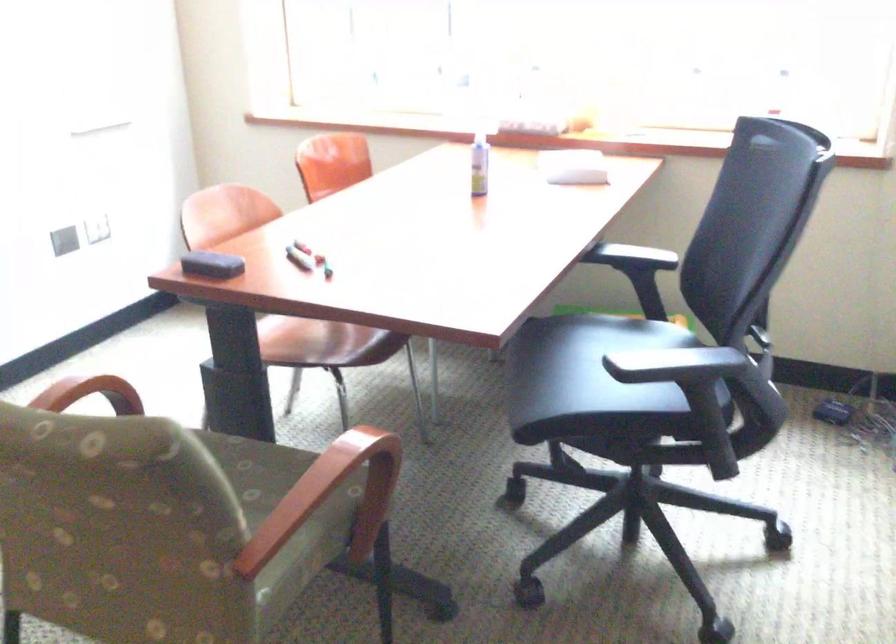
The location [299,258] corresponds to which object?

It corresponds to the red dry-erase marker in the image.